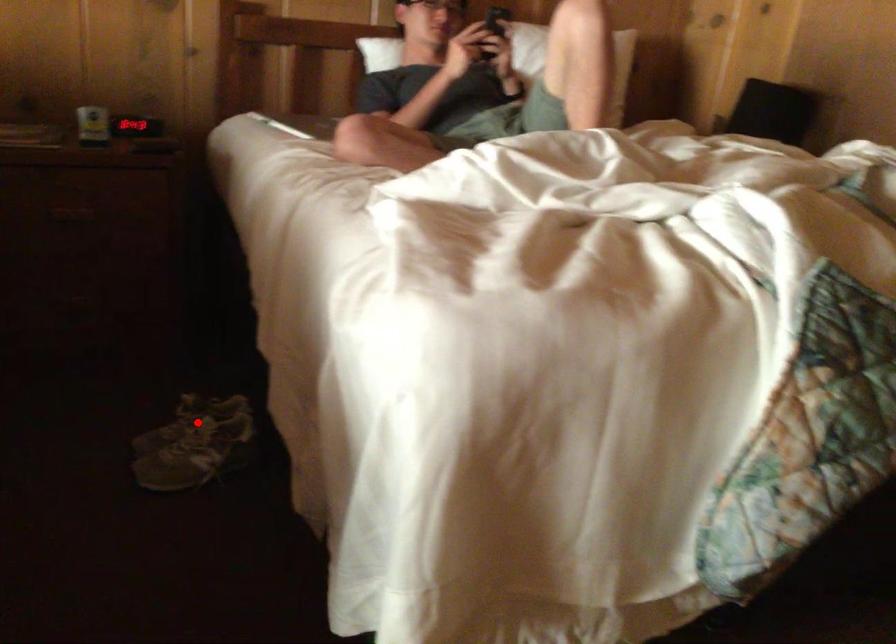
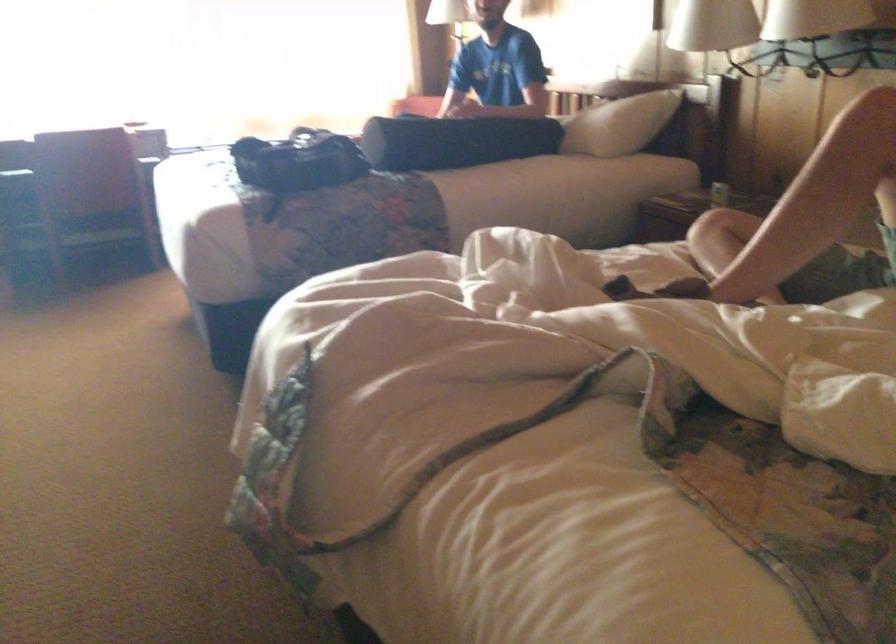
Question: I am providing you with two images of the same scene from different viewpoints. A red point is marked on the first image. Can you still see the location of the red point in image 2?

Choices:
 (A) Yes
 (B) No

Answer: (B)